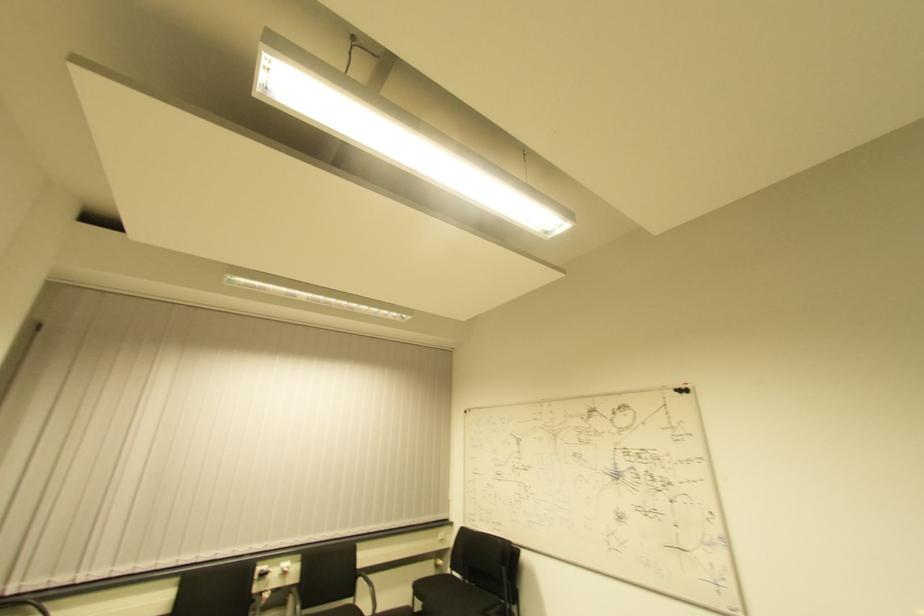
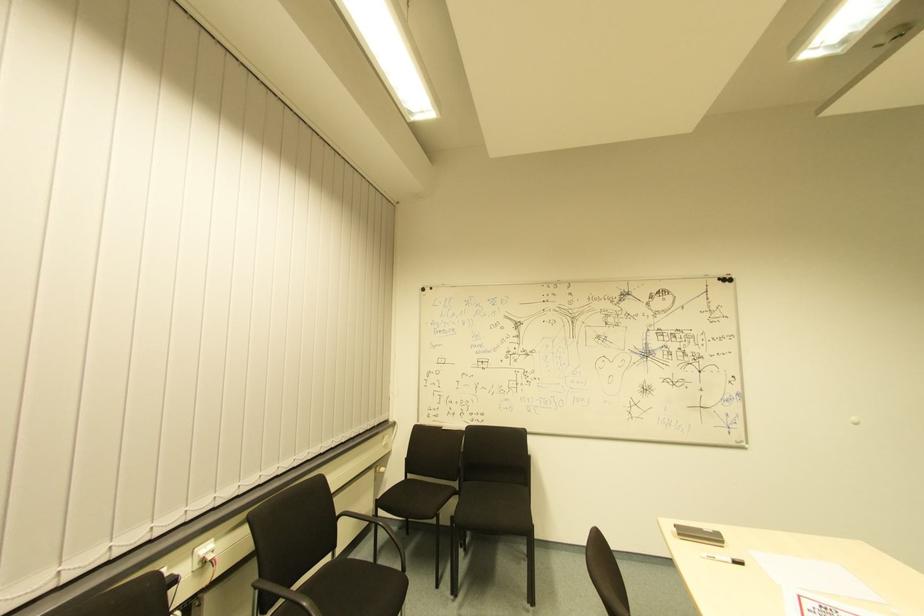
The point at [466,415] is marked in the first image. Where is the corresponding point in the second image?

(427, 293)